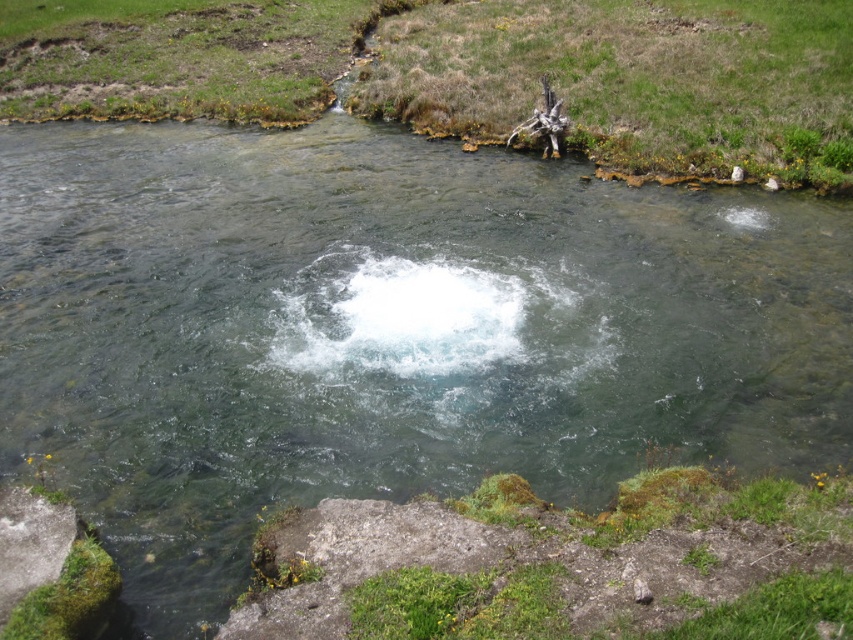
Question: Can you confirm if gray rough rock at lower left is positioned above brown wood log at upper right?

Choices:
 (A) yes
 (B) no

Answer: (B)

Question: From the image, what is the correct spatial relationship of gray rough rock at lower left in relation to brown wood log at upper right?

Choices:
 (A) below
 (B) above

Answer: (A)

Question: Which object appears closest to the camera in this image?

Choices:
 (A) gray rough rock at lower left
 (B) brown wood log at upper right

Answer: (A)

Question: Which point is closer to the camera?

Choices:
 (A) (53, 502)
 (B) (555, 136)

Answer: (A)

Question: Is gray rough rock at lower left in front of brown wood log at upper right?

Choices:
 (A) yes
 (B) no

Answer: (A)

Question: Among these points, which one is nearest to the camera?

Choices:
 (A) (28, 532)
 (B) (531, 118)

Answer: (A)